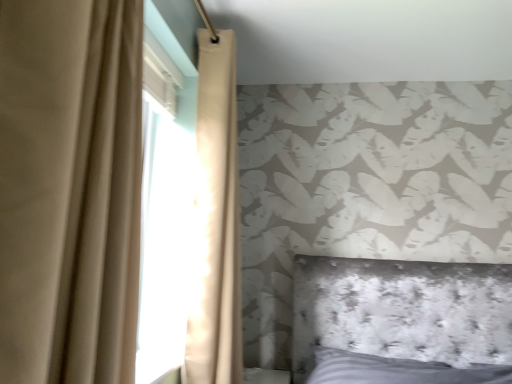
Locate an element on the screen. This screenshot has height=384, width=512. beige fabric curtain at upper left, which is the 2th curtain in front-to-back order is located at coordinates (215, 222).

What is the approximate height of beige fabric curtain at upper left, acting as the first curtain starting from the back?

It is 1.65 meters.

What do you see at coordinates (215, 222) in the screenshot? Image resolution: width=512 pixels, height=384 pixels. I see `beige fabric curtain at upper left, acting as the first curtain starting from the back` at bounding box center [215, 222].

Locate an element on the screen. This screenshot has height=384, width=512. beige fabric curtain at left, which appears as the 1th curtain when viewed from the front is located at coordinates (69, 189).

What is the approximate width of beige fabric curtain at left, which appears as the 1th curtain when viewed from the front?

beige fabric curtain at left, which appears as the 1th curtain when viewed from the front, is 7.85 inches in width.

What do you see at coordinates (69, 189) in the screenshot? I see `beige fabric curtain at left, placed as the 2th curtain when sorted from back to front` at bounding box center [69, 189].

Image resolution: width=512 pixels, height=384 pixels. I want to click on beige fabric curtain at upper left, acting as the first curtain starting from the back, so click(215, 222).

Would you say beige fabric curtain at upper left, which is the 2th curtain in front-to-back order, is to the left or to the right of beige fabric curtain at left, which appears as the 1th curtain when viewed from the front, in the picture?

From the image, it's evident that beige fabric curtain at upper left, which is the 2th curtain in front-to-back order, is to the right of beige fabric curtain at left, which appears as the 1th curtain when viewed from the front.

From the picture: Does beige fabric curtain at upper left, which is the 2th curtain in front-to-back order, lie behind beige fabric curtain at left, placed as the 2th curtain when sorted from back to front?

That is True.

Which is behind, point (194, 239) or point (52, 6)?

The point (194, 239) is farther from the camera.

From the image's perspective, relative to beige fabric curtain at left, placed as the 2th curtain when sorted from back to front, is beige fabric curtain at upper left, which is the 2th curtain in front-to-back order, above or below?

From the image's perspective, beige fabric curtain at upper left, which is the 2th curtain in front-to-back order, appears below beige fabric curtain at left, placed as the 2th curtain when sorted from back to front.

From a real-world perspective, is beige fabric curtain at upper left, acting as the first curtain starting from the back, located higher than beige fabric curtain at left, placed as the 2th curtain when sorted from back to front?

Correct, in the physical world, beige fabric curtain at upper left, acting as the first curtain starting from the back, is higher than beige fabric curtain at left, placed as the 2th curtain when sorted from back to front.

Considering the relative sizes of beige fabric curtain at upper left, acting as the first curtain starting from the back, and beige fabric curtain at left, placed as the 2th curtain when sorted from back to front, in the image provided, is beige fabric curtain at upper left, acting as the first curtain starting from the back, wider than beige fabric curtain at left, placed as the 2th curtain when sorted from back to front,?

Yes.

Who is taller, beige fabric curtain at upper left, which is the 2th curtain in front-to-back order, or beige fabric curtain at left, which appears as the 1th curtain when viewed from the front?

With more height is beige fabric curtain at upper left, which is the 2th curtain in front-to-back order.

Is beige fabric curtain at upper left, which is the 2th curtain in front-to-back order, bigger or smaller than beige fabric curtain at left, which appears as the 1th curtain when viewed from the front?

Clearly, beige fabric curtain at upper left, which is the 2th curtain in front-to-back order, is larger in size than beige fabric curtain at left, which appears as the 1th curtain when viewed from the front.

Is beige fabric curtain at upper left, which is the 2th curtain in front-to-back order, surrounding beige fabric curtain at left, placed as the 2th curtain when sorted from back to front?

No, beige fabric curtain at left, placed as the 2th curtain when sorted from back to front, is not a part of beige fabric curtain at upper left, which is the 2th curtain in front-to-back order.

Is beige fabric curtain at upper left, acting as the first curtain starting from the back, positioned far away from beige fabric curtain at left, placed as the 2th curtain when sorted from back to front?

No, there isn't a large distance between beige fabric curtain at upper left, acting as the first curtain starting from the back, and beige fabric curtain at left, placed as the 2th curtain when sorted from back to front.

Is beige fabric curtain at upper left, which is the 2th curtain in front-to-back order, aimed at beige fabric curtain at left, which appears as the 1th curtain when viewed from the front?

No, beige fabric curtain at upper left, which is the 2th curtain in front-to-back order, does not turn towards beige fabric curtain at left, which appears as the 1th curtain when viewed from the front.

How many degrees apart are the facing directions of beige fabric curtain at upper left, which is the 2th curtain in front-to-back order, and beige fabric curtain at left, which appears as the 1th curtain when viewed from the front?

The facing directions of beige fabric curtain at upper left, which is the 2th curtain in front-to-back order, and beige fabric curtain at left, which appears as the 1th curtain when viewed from the front, are 0.00072 degrees apart.

Image resolution: width=512 pixels, height=384 pixels. I want to click on curtain that appears in front of the beige fabric curtain at upper left, acting as the first curtain starting from the back, so click(69, 189).

Can you confirm if beige fabric curtain at left, placed as the 2th curtain when sorted from back to front, is positioned to the left of beige fabric curtain at upper left, acting as the first curtain starting from the back?

Yes, beige fabric curtain at left, placed as the 2th curtain when sorted from back to front, is to the left of beige fabric curtain at upper left, acting as the first curtain starting from the back.

Considering the positions of objects beige fabric curtain at left, which appears as the 1th curtain when viewed from the front, and beige fabric curtain at upper left, which is the 2th curtain in front-to-back order, in the image provided, who is in front, beige fabric curtain at left, which appears as the 1th curtain when viewed from the front, or beige fabric curtain at upper left, which is the 2th curtain in front-to-back order,?

beige fabric curtain at left, which appears as the 1th curtain when viewed from the front, is closer to the camera.

Is point (100, 378) positioned in front of point (211, 139)?

Yes, it is in front of point (211, 139).

From the image's perspective, which one is positioned higher, beige fabric curtain at left, which appears as the 1th curtain when viewed from the front, or beige fabric curtain at upper left, which is the 2th curtain in front-to-back order?

beige fabric curtain at left, which appears as the 1th curtain when viewed from the front, from the image's perspective.

From a real-world perspective, is beige fabric curtain at left, which appears as the 1th curtain when viewed from the front, below beige fabric curtain at upper left, which is the 2th curtain in front-to-back order?

Correct, in the physical world, beige fabric curtain at left, which appears as the 1th curtain when viewed from the front, is lower than beige fabric curtain at upper left, which is the 2th curtain in front-to-back order.

Looking at their sizes, would you say beige fabric curtain at left, which appears as the 1th curtain when viewed from the front, is wider or thinner than beige fabric curtain at upper left, acting as the first curtain starting from the back?

Clearly, beige fabric curtain at left, which appears as the 1th curtain when viewed from the front, has less width compared to beige fabric curtain at upper left, acting as the first curtain starting from the back.

Does beige fabric curtain at left, which appears as the 1th curtain when viewed from the front, have a lesser height compared to beige fabric curtain at upper left, which is the 2th curtain in front-to-back order?

Indeed, beige fabric curtain at left, which appears as the 1th curtain when viewed from the front, has a lesser height compared to beige fabric curtain at upper left, which is the 2th curtain in front-to-back order.

Between beige fabric curtain at left, placed as the 2th curtain when sorted from back to front, and beige fabric curtain at upper left, which is the 2th curtain in front-to-back order, which one has smaller size?

With smaller size is beige fabric curtain at left, placed as the 2th curtain when sorted from back to front.

Is beige fabric curtain at left, which appears as the 1th curtain when viewed from the front, surrounding beige fabric curtain at upper left, which is the 2th curtain in front-to-back order?

No, beige fabric curtain at upper left, which is the 2th curtain in front-to-back order, is located outside of beige fabric curtain at left, which appears as the 1th curtain when viewed from the front.

Based on the photo, is beige fabric curtain at left, placed as the 2th curtain when sorted from back to front, far away from beige fabric curtain at upper left, acting as the first curtain starting from the back?

No, beige fabric curtain at left, placed as the 2th curtain when sorted from back to front, is in close proximity to beige fabric curtain at upper left, acting as the first curtain starting from the back.

Is beige fabric curtain at left, which appears as the 1th curtain when viewed from the front, facing away from beige fabric curtain at upper left, which is the 2th curtain in front-to-back order?

No, beige fabric curtain at left, which appears as the 1th curtain when viewed from the front, is not facing the opposite direction of beige fabric curtain at upper left, which is the 2th curtain in front-to-back order.

Can you tell me how much beige fabric curtain at left, which appears as the 1th curtain when viewed from the front, and beige fabric curtain at upper left, acting as the first curtain starting from the back, differ in facing direction?

0.00072 degrees.

Measure the distance from beige fabric curtain at left, which appears as the 1th curtain when viewed from the front, to beige fabric curtain at upper left, acting as the first curtain starting from the back.

A distance of 39.22 inches exists between beige fabric curtain at left, which appears as the 1th curtain when viewed from the front, and beige fabric curtain at upper left, acting as the first curtain starting from the back.

At what (x,y) coordinates should I click in order to perform the action: click on curtain behind the beige fabric curtain at left, placed as the 2th curtain when sorted from back to front. Please return your answer as a coordinate pair (x, y). The height and width of the screenshot is (384, 512). Looking at the image, I should click on (215, 222).

Locate an element on the screen. This screenshot has height=384, width=512. curtain lying on the left of beige fabric curtain at upper left, acting as the first curtain starting from the back is located at coordinates (69, 189).

Locate an element on the screen. This screenshot has height=384, width=512. curtain behind the beige fabric curtain at left, which appears as the 1th curtain when viewed from the front is located at coordinates (215, 222).